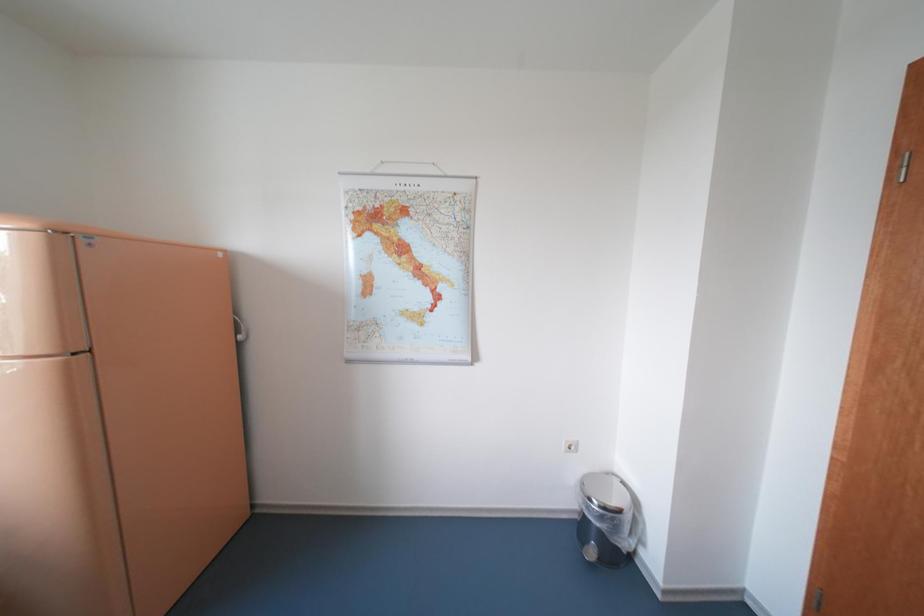
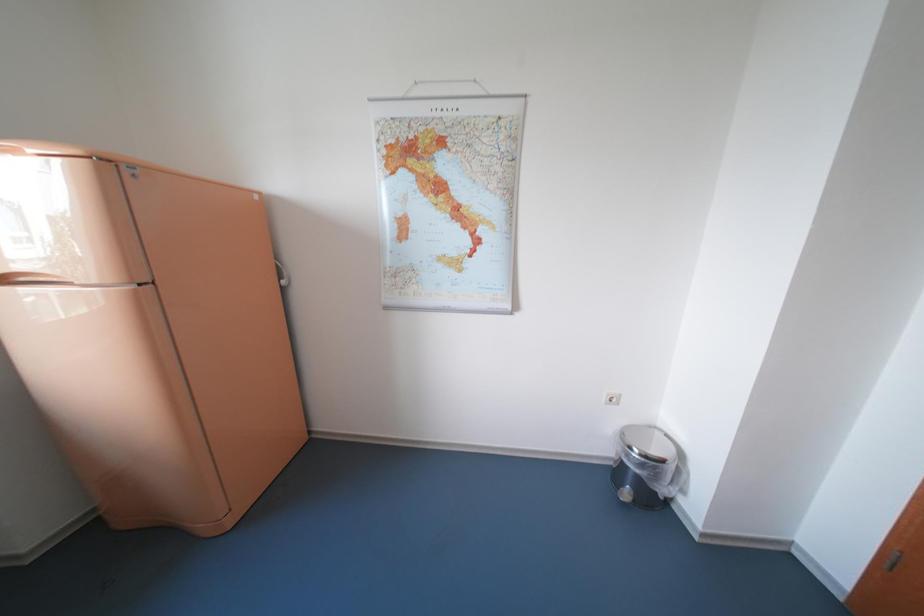
Which direction would the cameraman need to move to produce the second image?

The cameraman walked toward left, forward.